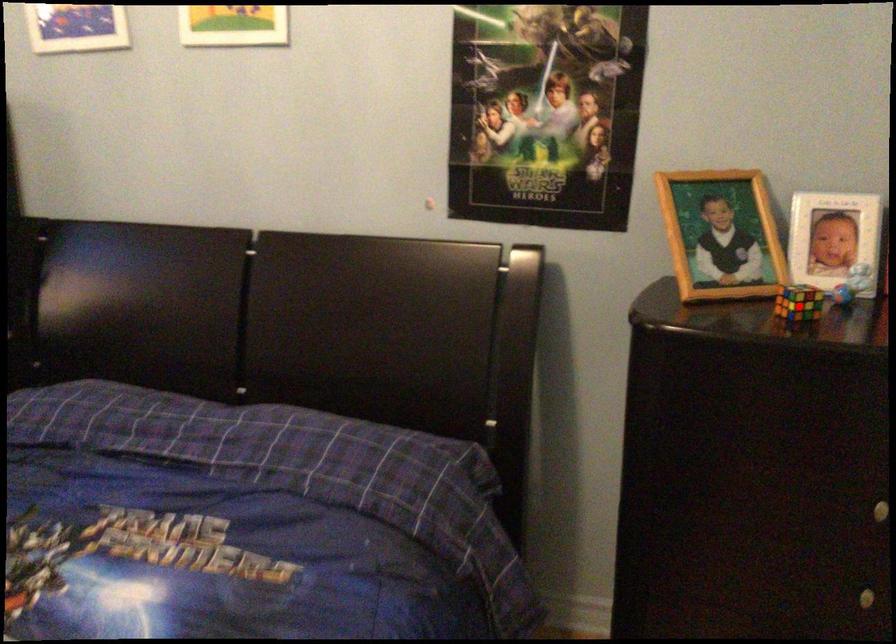
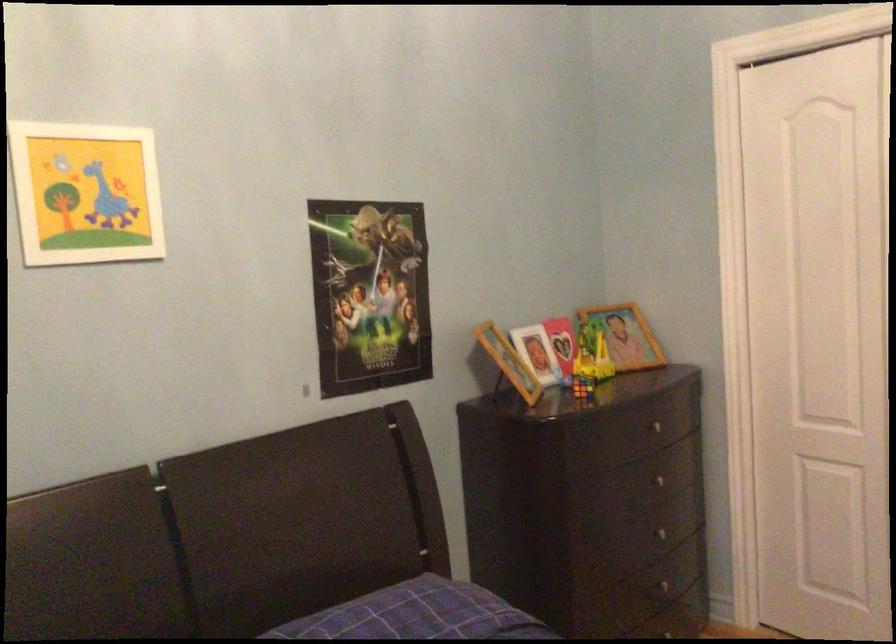
The point at the highlighted location is marked in the first image. Where is the corresponding point in the second image?

(582, 386)